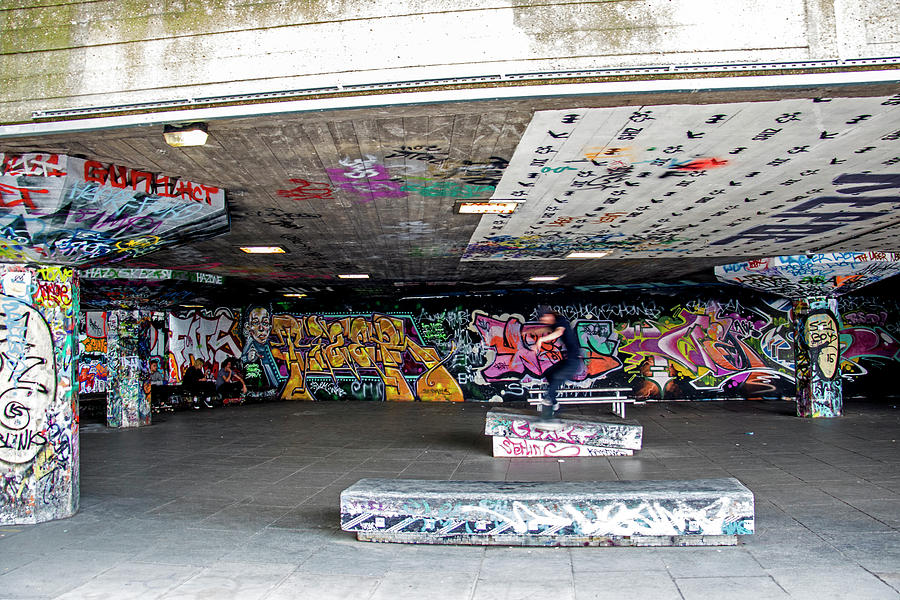
Where is `light in first column left`? light in first column left is located at coordinates (265, 249), (289, 292), (183, 144).